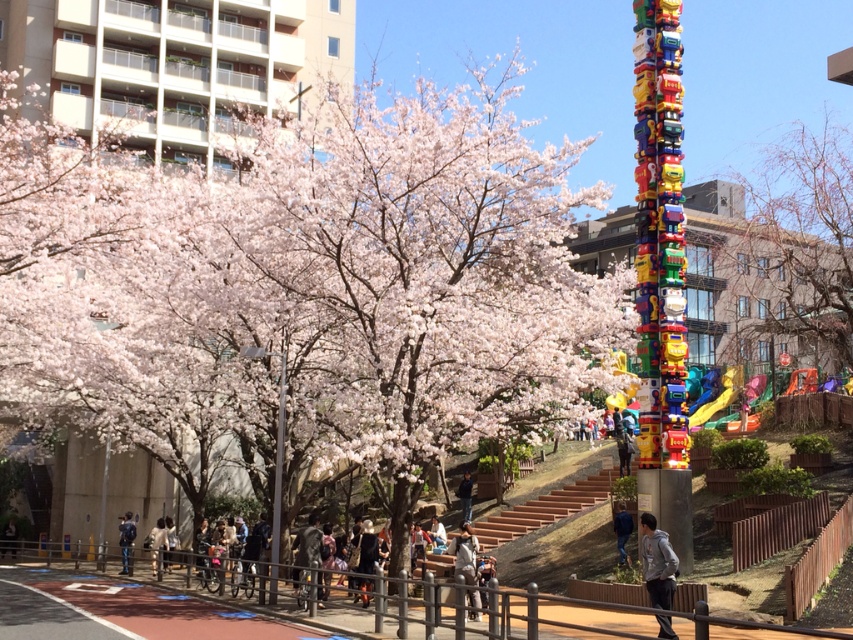
Question: Does metallic gray pole at center appear over black matte jacket at center?

Choices:
 (A) yes
 (B) no

Answer: (A)

Question: Among these points, which one is nearest to the camera?

Choices:
 (A) (456, 490)
 (B) (467, 593)

Answer: (B)

Question: Estimate the real-world distances between objects in this image. Which object is farther from the light brown leather jacket at lower center?

Choices:
 (A) denim jacket at center
 (B) dark gray jacket at lower left
 (C) dark blue jeans at lower left
 (D) light blue denim jacket at lower center

Answer: (B)

Question: Which object appears farthest from the camera in this image?

Choices:
 (A) gray hoodie at lower right
 (B) dark gray jacket at lower left
 (C) black fabric jacket at center
 (D) bare wood playground at right

Answer: (B)

Question: Can you confirm if gray hoodie at lower right is positioned above dark blue jeans at lower left?

Choices:
 (A) no
 (B) yes

Answer: (B)

Question: Is light brown leather jacket at lower center closer to the viewer compared to blue denim jacket at lower right?

Choices:
 (A) no
 (B) yes

Answer: (A)